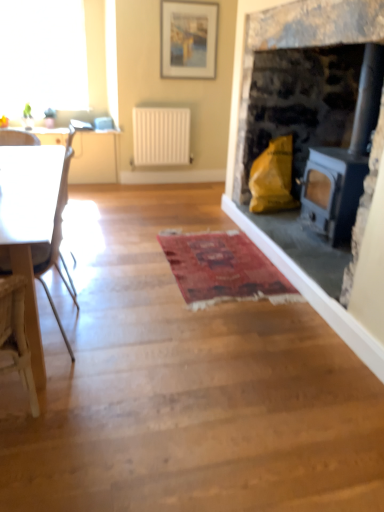
Question: From the image's perspective, is white glossy table at left above or below white matte radiator at center?

Choices:
 (A) below
 (B) above

Answer: (A)

Question: From a real-world perspective, is white glossy table at left physically located above or below white matte radiator at center?

Choices:
 (A) below
 (B) above

Answer: (A)

Question: Based on their relative distances, which object is farther from the matte white picture frame at upper center?

Choices:
 (A) transparent glass window at upper left
 (B) white matte radiator at center
 (C) white plastic chair at left
 (D) white glossy table at left
 (E) matte stone fireplace at right

Answer: (C)

Question: Which of these objects is positioned farthest from the matte stone fireplace at right?

Choices:
 (A) white matte radiator at center
 (B) transparent glass window at upper left
 (C) white glossy table at left
 (D) white glossy countertop at upper left
 (E) white plastic chair at left

Answer: (B)